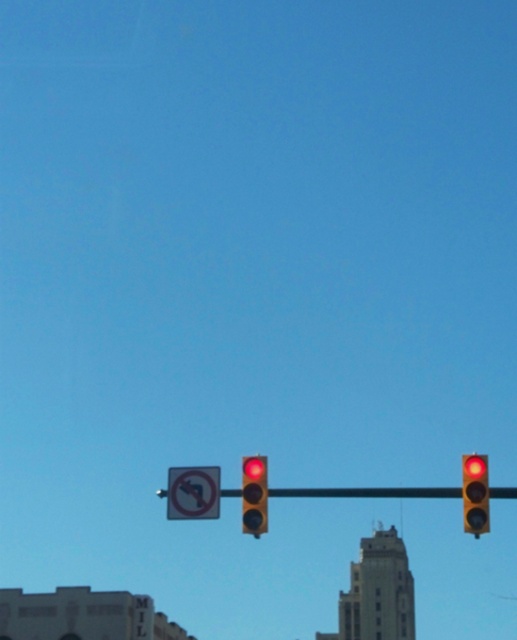
You are a pedestrian standing in front of the metallic yellow pole at center and the matte glass traffic light at center. Which object is closer to you?

The metallic yellow pole at center is closer to you than the matte glass traffic light at center.

You are a driver approaching an intersection and see the metallic yellow pole at center and the matte glass traffic light at upper center. Which object is positioned higher up in the image?

The matte glass traffic light at upper center is positioned higher up in the image because the metallic yellow pole at center is located below it.